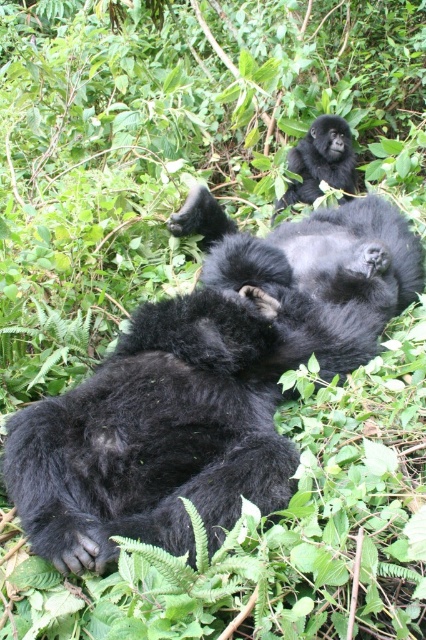
You are a photographer trying to capture a closeup shot of the adult gorilla lying on its back. You notice two points in the scene marked as point 1 at coordinates point (321, 320) and point 2 at coordinates point (339, 144). Which point should you focus on to ensure the adult gorilla is in sharp focus?

Point 1 at coordinates point (321, 320) is closer to the camera than point 2 at coordinates point (339, 144), so focusing on point 1 will ensure the adult gorilla is in sharp focus.

You are a wildlife photographer aiming to capture a photo of the black fuzzy gorilla at center and the shiny black gorilla at upper center. If you want to ensure both gorillas are in the same frame, which gorilla should you position closer to the camera?

The black fuzzy gorilla at center is positioned under the shiny black gorilla at upper center. To include both in the same frame, you should position the camera closer to the black fuzzy gorilla at center so that the shiny black gorilla at upper center remains visible above it.